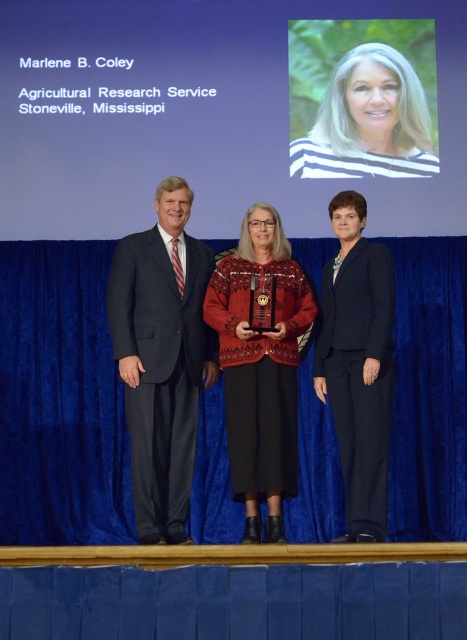
Is blue fabric curtain at center taller than black smooth suit at right?

Indeed, blue fabric curtain at center has a greater height compared to black smooth suit at right.

Find the location of `blue fabric curtain at center`. blue fabric curtain at center is located at coordinates (59, 400).

This screenshot has height=640, width=467. I want to click on black smooth suit at right, so click(359, 376).

Does black smooth suit at right have a greater height compared to striped shirt at upper center?

Incorrect, black smooth suit at right's height is not larger of striped shirt at upper center's.

Image resolution: width=467 pixels, height=640 pixels. What are the coordinates of `black smooth suit at right` in the screenshot? It's located at [359, 376].

Which is behind, point (174, 241) or point (318, 150)?

Positioned behind is point (318, 150).

Who is more forward, (126, 337) or (403, 81)?

Point (126, 337) is more forward.

Image resolution: width=467 pixels, height=640 pixels. What do you see at coordinates (162, 358) in the screenshot?
I see `dark blue suit at center` at bounding box center [162, 358].

Find the location of `dark blue suit at center`. dark blue suit at center is located at coordinates (162, 358).